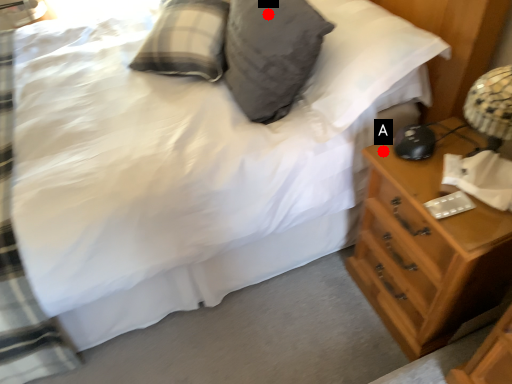
Question: Two points are circled on the image, labeled by A and B beside each circle. Which point is closer to the camera?

Choices:
 (A) A is closer
 (B) B is closer

Answer: (A)